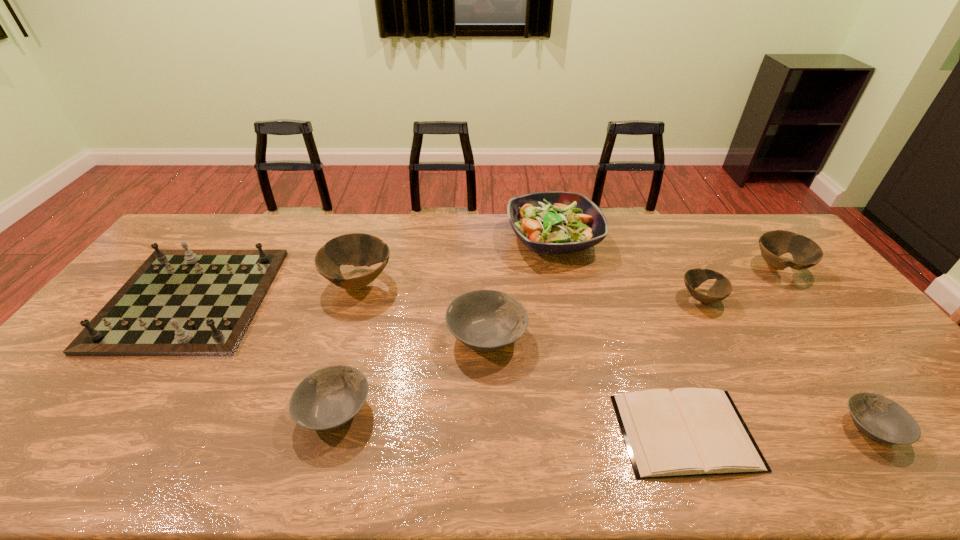
This screenshot has height=540, width=960. In order to click on blue salad plate in this screenshot , I will do `click(553, 222)`.

Find the location of a particular element. This screenshot has height=540, width=960. the leftmost brown bowl is located at coordinates coord(357,249).

Find the location of a particular element. Image resolution: width=960 pixels, height=540 pixels. the tallest bowl is located at coordinates (357, 249).

The image size is (960, 540). What are the coordinates of `the second biggest brown bowl` in the screenshot? It's located at (806, 253).

You are a GUI agent. You are given a task and a screenshot of the screen. Output one action in this format:
    pyautogui.click(x=<x>, y=<y>)
    Task: Click on the chessboard
    
    Given the screenshot: What is the action you would take?
    pyautogui.click(x=186, y=302)

In order to click on black chessboard in this screenshot , I will do `click(186, 302)`.

Where is `the farthest gray bowl`? the farthest gray bowl is located at coordinates (484, 320).

The height and width of the screenshot is (540, 960). What are the coordinates of `the second gray bowl from left to right` in the screenshot? It's located at (484, 320).

Identify the location of the fourth bowl from left to right. (693, 278).

Locate an element on the screen. This screenshot has height=540, width=960. the smallest brown bowl is located at coordinates (693, 278).